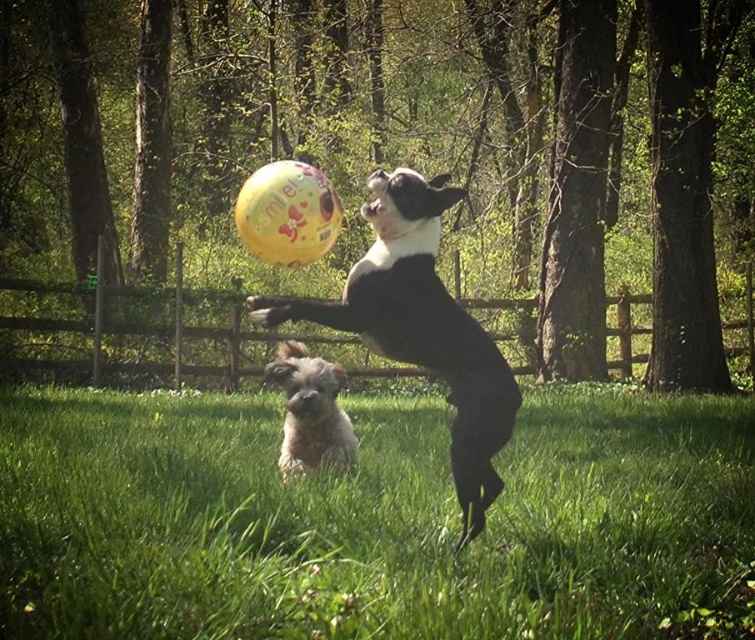
Question: Which object appears closest to the camera in this image?

Choices:
 (A) black and white fur dog at center
 (B) green grass at lower center

Answer: (B)

Question: Observing the image, what is the correct spatial positioning of green grass at lower center in reference to black and white fur dog at center?

Choices:
 (A) above
 (B) below

Answer: (B)

Question: Is green grass at lower center to the left of black and white fur dog at center from the viewer's perspective?

Choices:
 (A) yes
 (B) no

Answer: (B)

Question: Among these objects, which one is nearest to the camera?

Choices:
 (A) fluffy white dog at lower center
 (B) black and white fur dog at center
 (C) green grass at lower center

Answer: (C)

Question: Which point is farther from the camera taking this photo?

Choices:
 (A) (91, 401)
 (B) (325, 433)
 (C) (427, 227)

Answer: (A)

Question: Does black and white fur dog at center appear on the left side of fluffy white dog at lower center?

Choices:
 (A) no
 (B) yes

Answer: (A)